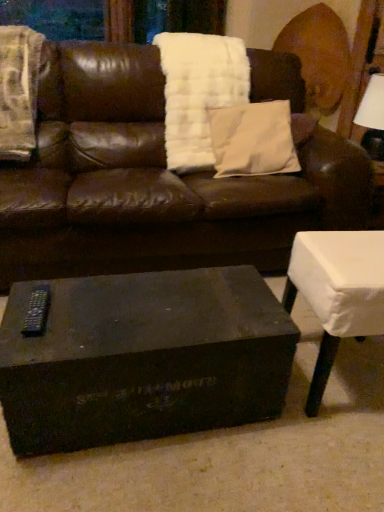
Question: Considering the relative sizes of white cloth-covered table at lower right and black plastic remote at lower left in the image provided, is white cloth-covered table at lower right smaller than black plastic remote at lower left?

Choices:
 (A) no
 (B) yes

Answer: (A)

Question: Considering the relative positions of white cloth-covered table at lower right and black plastic remote at lower left in the image provided, is white cloth-covered table at lower right to the left of black plastic remote at lower left from the viewer's perspective?

Choices:
 (A) no
 (B) yes

Answer: (A)

Question: Is white cloth-covered table at lower right shorter than black plastic remote at lower left?

Choices:
 (A) no
 (B) yes

Answer: (A)

Question: From a real-world perspective, is white cloth-covered table at lower right on black plastic remote at lower left?

Choices:
 (A) yes
 (B) no

Answer: (B)

Question: Would you say white cloth-covered table at lower right is a long distance from black plastic remote at lower left?

Choices:
 (A) no
 (B) yes

Answer: (A)

Question: Is white soft pillow at center to the left or to the right of white cloth-covered table at lower right in the image?

Choices:
 (A) right
 (B) left

Answer: (B)

Question: Considering the positions of white soft pillow at center and white cloth-covered table at lower right in the image, is white soft pillow at center wider or thinner than white cloth-covered table at lower right?

Choices:
 (A) wide
 (B) thin

Answer: (B)

Question: Relative to white cloth-covered table at lower right, is white soft pillow at center in front or behind?

Choices:
 (A) front
 (B) behind

Answer: (B)

Question: From the image's perspective, is white soft pillow at center above or below white cloth-covered table at lower right?

Choices:
 (A) above
 (B) below

Answer: (A)

Question: Is white cloth-covered table at lower right bigger or smaller than white fluffy blanket at upper center, the first blanket in the right-to-left sequence?

Choices:
 (A) big
 (B) small

Answer: (B)

Question: Is white cloth-covered table at lower right wider or thinner than white fluffy blanket at upper center, the first blanket in the right-to-left sequence?

Choices:
 (A) wide
 (B) thin

Answer: (B)

Question: In the image, is white cloth-covered table at lower right positioned in front of or behind white fluffy blanket at upper center, the 2th blanket positioned from the left?

Choices:
 (A) behind
 (B) front

Answer: (B)

Question: In terms of height, does white cloth-covered table at lower right look taller or shorter compared to white fluffy blanket at upper center, the 2th blanket positioned from the left?

Choices:
 (A) tall
 (B) short

Answer: (B)

Question: From their relative heights in the image, would you say matte black coffee table at center is taller or shorter than white cloth-covered table at lower right?

Choices:
 (A) short
 (B) tall

Answer: (A)

Question: Is point (208, 297) closer or farther from the camera than point (372, 254)?

Choices:
 (A) farther
 (B) closer

Answer: (B)